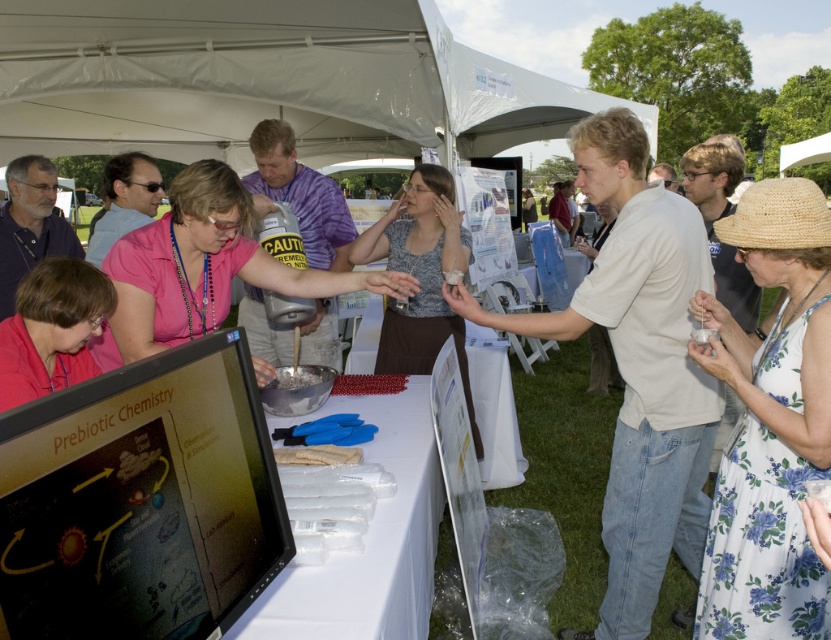
Question: Does white plastic table at center have a larger size compared to white crumbly substance at center?

Choices:
 (A) yes
 (B) no

Answer: (A)

Question: Is the position of white plastic table at center less distant than that of white crumbly substance at center?

Choices:
 (A) no
 (B) yes

Answer: (B)

Question: Where is white plastic table at center located in relation to matte pink shirt at lower left in the image?

Choices:
 (A) below
 (B) above

Answer: (A)

Question: Which object is closer to the camera taking this photo?

Choices:
 (A) white crumbly substance at center
 (B) white plastic table at center
 (C) matte pink shirt at lower left

Answer: (B)

Question: Among these points, which one is nearest to the camera?

Choices:
 (A) (416, 561)
 (B) (166, 292)
 (C) (94, 292)
 (D) (726, 227)

Answer: (A)

Question: Considering the real-world distances, which object is closest to the pink fabric shirt at center?

Choices:
 (A) matte pink shirt at lower left
 (B) strawmaterial/texturehat at right
 (C) white plastic table at center
 (D) white crumbly substance at center

Answer: (A)